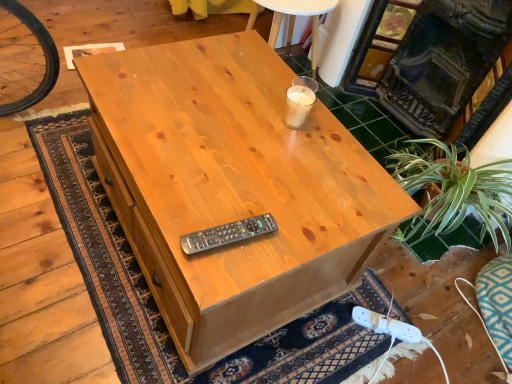
Identify the location of free spot in front of black plastic remote at center. This screenshot has height=384, width=512. (217, 270).